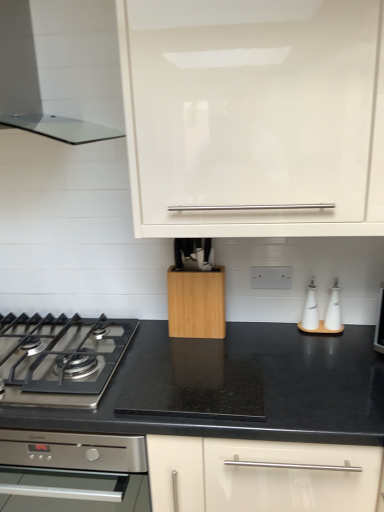
Question: Considering the relative positions of stainless steel gas stove at lower left and white glossy cabinet at upper center in the image provided, is stainless steel gas stove at lower left to the left or to the right of white glossy cabinet at upper center?

Choices:
 (A) left
 (B) right

Answer: (A)

Question: From a real-world perspective, is stainless steel gas stove at lower left positioned above or below white glossy cabinet at upper center?

Choices:
 (A) above
 (B) below

Answer: (B)

Question: Considering the real-world distances, which object is closest to the white glossy cabinet at upper center?

Choices:
 (A) beech wood knife block at center
 (B) stainless steel gas stove at lower left
 (C) transparent glass range hood at upper left
 (D) white glossy oil bottles at right

Answer: (C)

Question: Which object is the farthest from the white glossy oil bottles at right?

Choices:
 (A) stainless steel gas stove at lower left
 (B) beech wood knife block at center
 (C) transparent glass range hood at upper left
 (D) white glossy cabinet at upper center

Answer: (C)